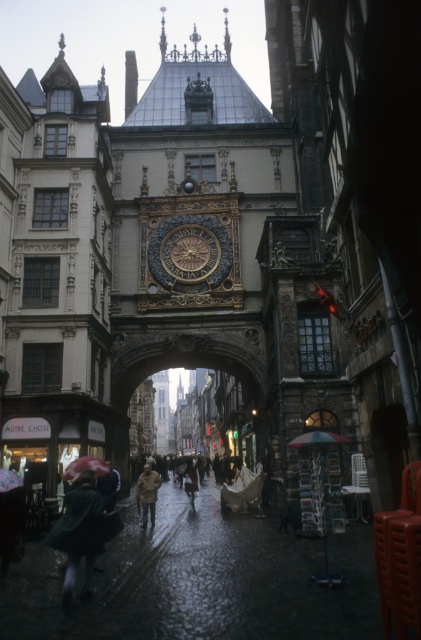
Question: Which point is closer to the camera taking this photo?

Choices:
 (A) (191, 480)
 (B) (136, 564)
 (C) (74, 480)

Answer: (B)

Question: Does transparent plastic umbrella at lower left have a greater width compared to multicolored fabric umbrella at lower center?

Choices:
 (A) yes
 (B) no

Answer: (B)

Question: Which point is closer to the camera?

Choices:
 (A) transparent plastic umbrella at lower left
 (B) transparent plastic umbrella at center
 (C) raincoat matte at center

Answer: (A)

Question: Which object appears closest to the camera in this image?

Choices:
 (A) transparent plastic umbrella at lower left
 (B) raincoat matte at center
 (C) transparent plastic umbrella at center
 (D) goldmetallicclock at center

Answer: (A)

Question: In this image, where is brown fuzzy coat at center located relative to transparent plastic umbrella at center?

Choices:
 (A) above
 (B) below

Answer: (A)

Question: Does multicolored fabric umbrella at lower center have a larger size compared to transparent plastic umbrella at center?

Choices:
 (A) yes
 (B) no

Answer: (B)